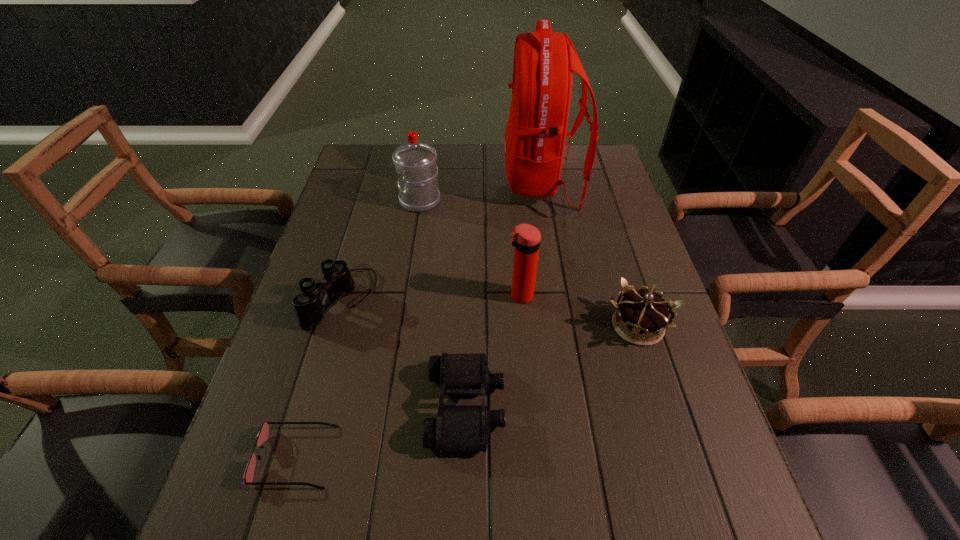
At what (x,y) coordinates should I click in order to perform the action: click on sunglasses that is at the left edge. Please return your answer as a coordinate pair (x, y). This screenshot has width=960, height=540. Looking at the image, I should click on (262, 436).

This screenshot has height=540, width=960. I want to click on backpack at the right edge, so click(544, 61).

Find the location of a particular element. This screenshot has width=960, height=540. crown that is at the right edge is located at coordinates (640, 314).

This screenshot has width=960, height=540. In order to click on object that is at the far right corner in this screenshot , I will do `click(544, 61)`.

Locate an element on the screen. vacant point at the far edge is located at coordinates (473, 154).

Identify the location of free space at the left edge of the desktop. (278, 506).

At what (x,y) coordinates should I click in order to perform the action: click on vacant space at the right edge of the desktop. Please return your answer as a coordinate pair (x, y). The width and height of the screenshot is (960, 540). Looking at the image, I should click on (588, 190).

The width and height of the screenshot is (960, 540). Identify the location of free space at the far left corner. (364, 167).

In the image, there is a desktop. Where is `vacant area at the near left corner`? vacant area at the near left corner is located at coordinates (222, 535).

In order to click on blank area at the far right corner in this screenshot , I will do click(581, 157).